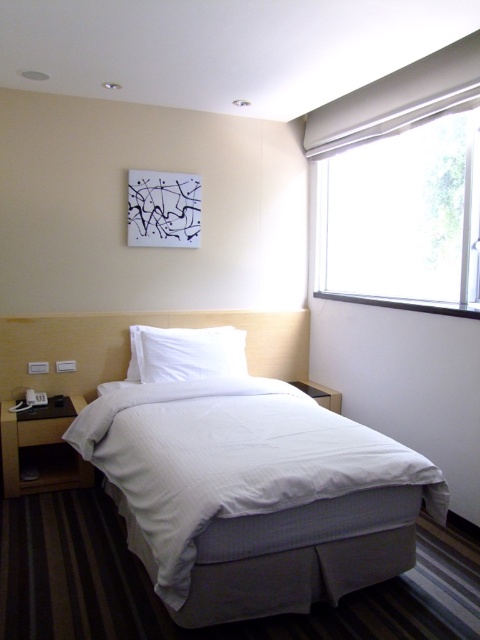
Question: Which object is closer to the camera taking this photo?

Choices:
 (A) white soft pillow at center
 (B) white matte window at upper right

Answer: (B)

Question: Considering the real-world distances, which object is closest to the white soft pillow at center?

Choices:
 (A) white textured bedsheet at center
 (B) white matte window at upper right

Answer: (A)

Question: Can you confirm if white textured bedsheet at center is positioned to the right of white soft pillow at center?

Choices:
 (A) yes
 (B) no

Answer: (A)

Question: Does white textured bedsheet at center have a larger size compared to white matte window at upper right?

Choices:
 (A) no
 (B) yes

Answer: (B)

Question: Which point is closer to the camera?

Choices:
 (A) (314, 497)
 (B) (434, 268)
 (C) (168, 378)

Answer: (A)

Question: Observing the image, what is the correct spatial positioning of white textured bedsheet at center in reference to white soft pillow at center?

Choices:
 (A) right
 (B) left

Answer: (A)